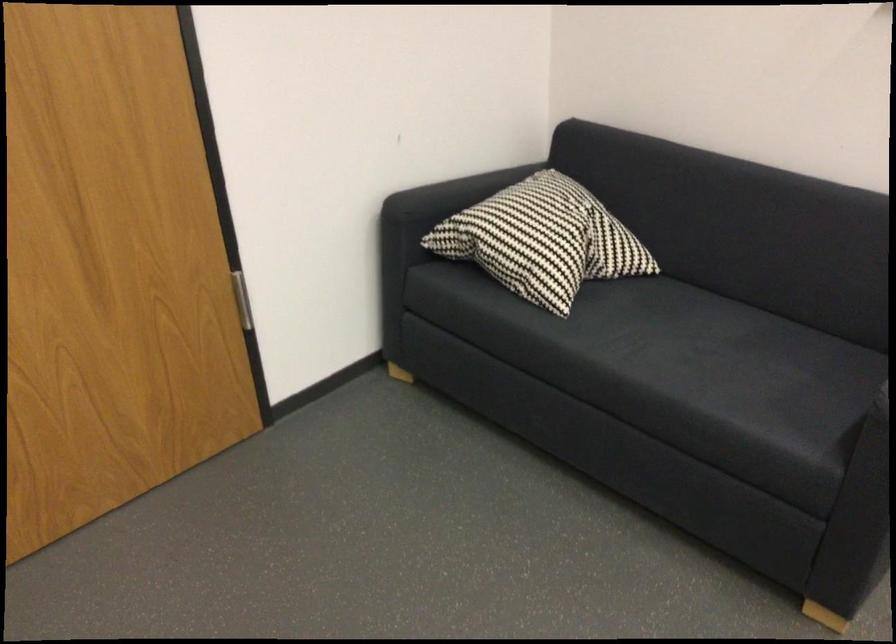
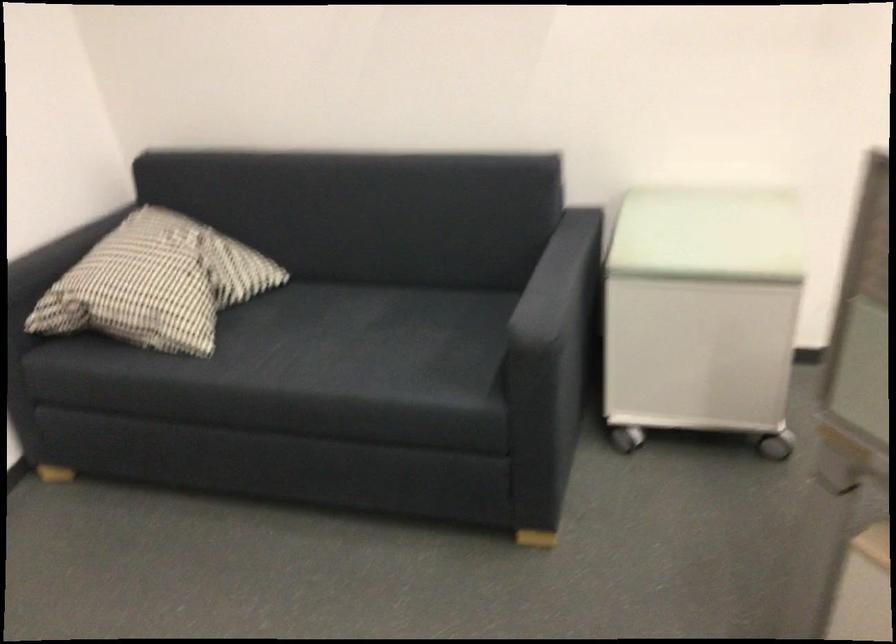
Question: How did the camera likely rotate?

Choices:
 (A) Left
 (B) Right
 (C) Up
 (D) Down

Answer: (B)